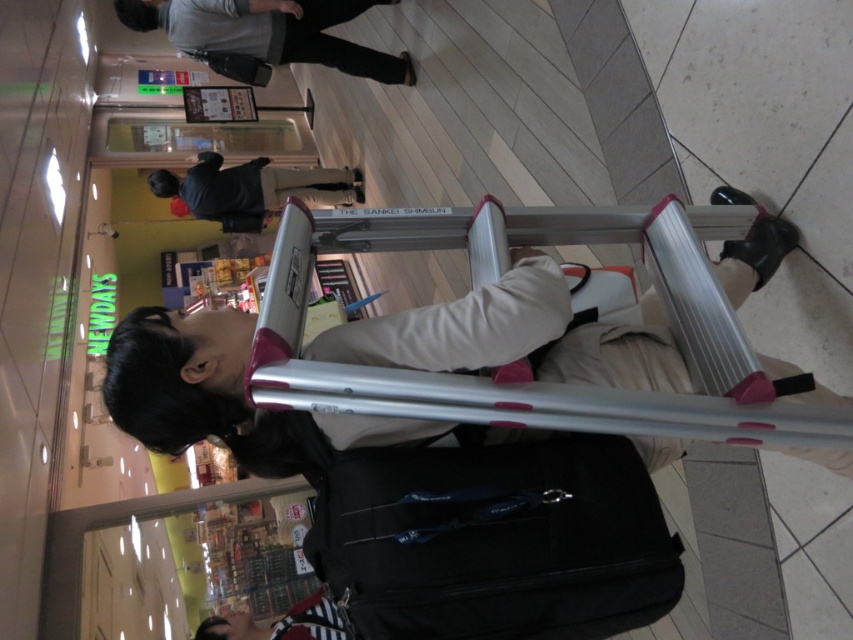
Question: Which point is farther to the camera?

Choices:
 (A) silver metallic crutches at center
 (B) black matte jacket at upper center
 (C) gray fabric jacket at upper center

Answer: (B)

Question: Can you confirm if black fabric suitcase at lower center is positioned to the right of black matte jacket at upper center?

Choices:
 (A) yes
 (B) no

Answer: (A)

Question: Based on their relative distances, which object is farther from the black fabric suitcase at lower center?

Choices:
 (A) silver metallic crutches at center
 (B) gray fabric jacket at upper center
 (C) black matte jacket at upper center

Answer: (C)

Question: Does black fabric suitcase at lower center appear over silver metallic crutches at center?

Choices:
 (A) no
 (B) yes

Answer: (A)

Question: Among these objects, which one is farthest from the camera?

Choices:
 (A) gray fabric jacket at upper center
 (B) silver metallic crutches at center
 (C) black fabric suitcase at lower center

Answer: (A)

Question: Does gray fabric jacket at upper center have a lesser width compared to black matte jacket at upper center?

Choices:
 (A) no
 (B) yes

Answer: (A)